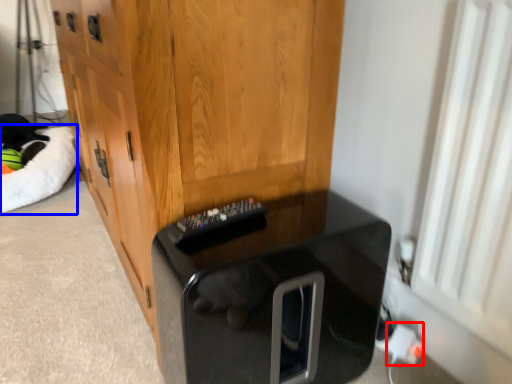
Question: Which object appears closest to the camera in this image, electric outlet (highlighted by a red box) or cat bed (highlighted by a blue box)?

Choices:
 (A) electric outlet
 (B) cat bed

Answer: (A)